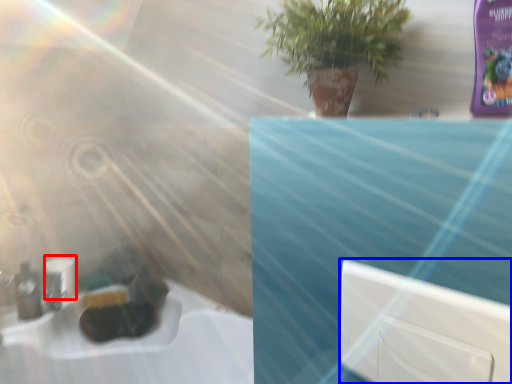
Question: Among these objects, which one is farthest to the camera, toilet paper (highlighted by a red box) or window (highlighted by a blue box)?

Choices:
 (A) toilet paper
 (B) window

Answer: (A)